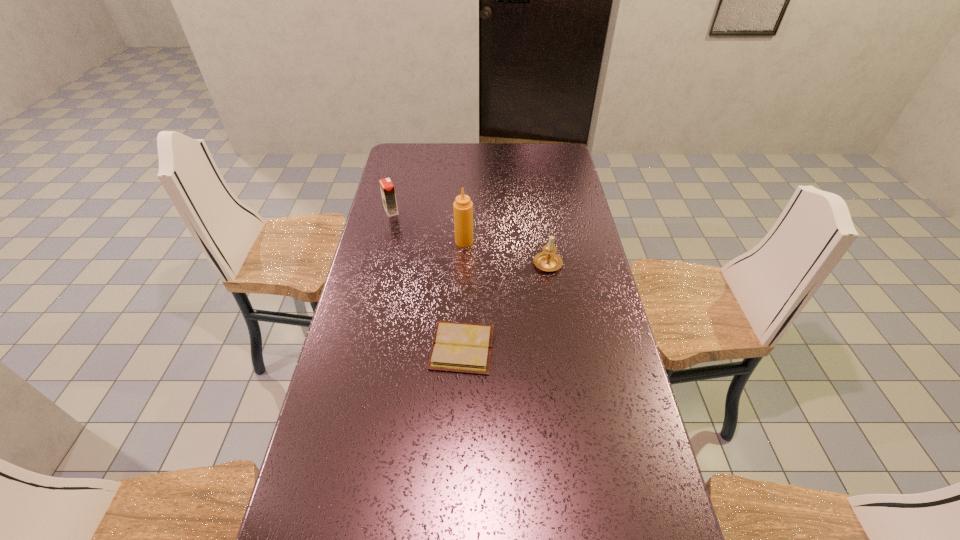
At what (x,y) coordinates should I click in order to perform the action: click on free space that satisfies the following two spatial constraints: 1. on the front side of the leftmost object; 2. on the right side of the nearest object. Please return your answer as a coordinate pair (x, y). Looking at the image, I should click on (359, 348).